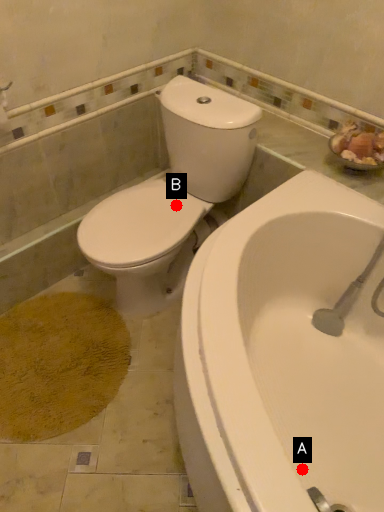
Question: Two points are circled on the image, labeled by A and B beside each circle. Which point is closer to the camera?

Choices:
 (A) A is closer
 (B) B is closer

Answer: (A)